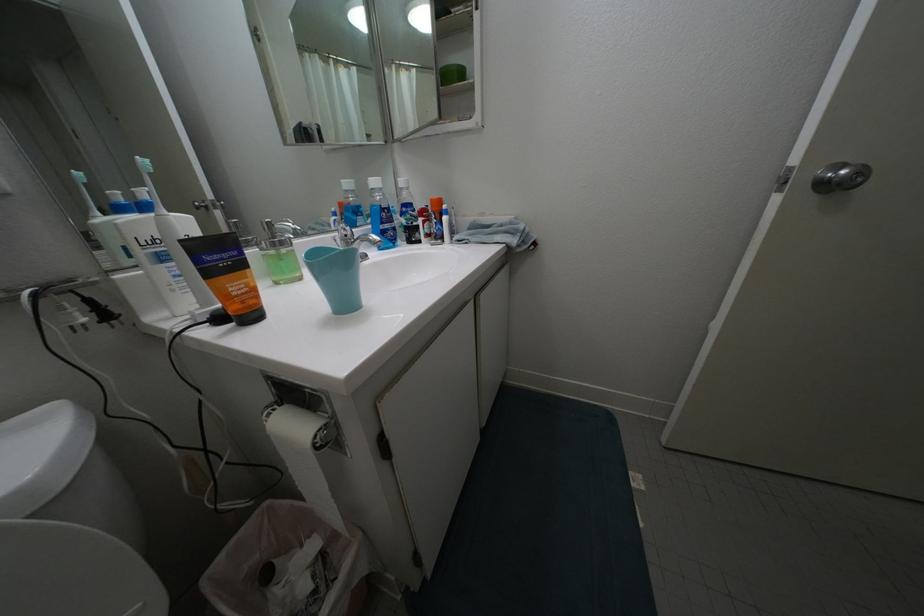
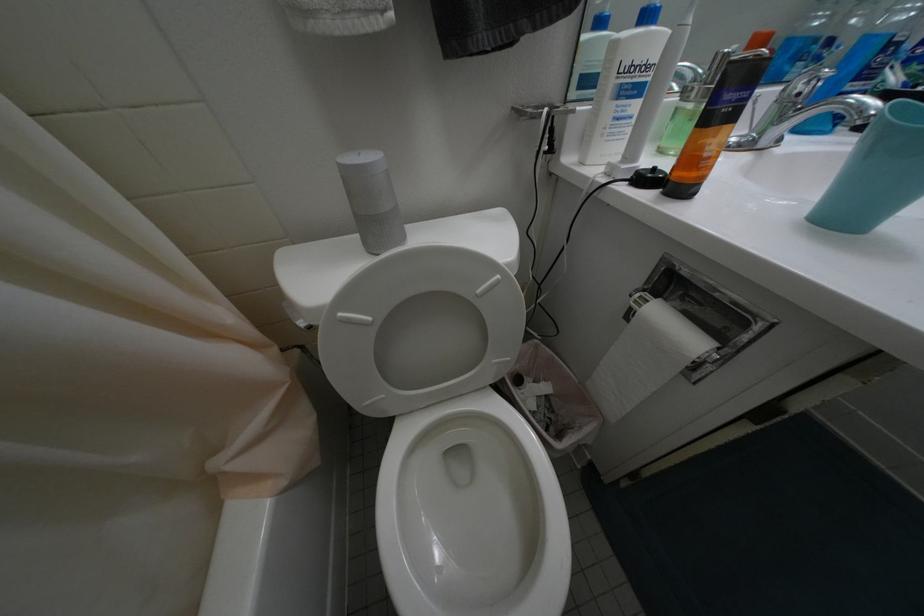
The images are taken continuously from a first-person perspective. In which direction is your viewpoint rotating?

The camera rotated toward left-down.